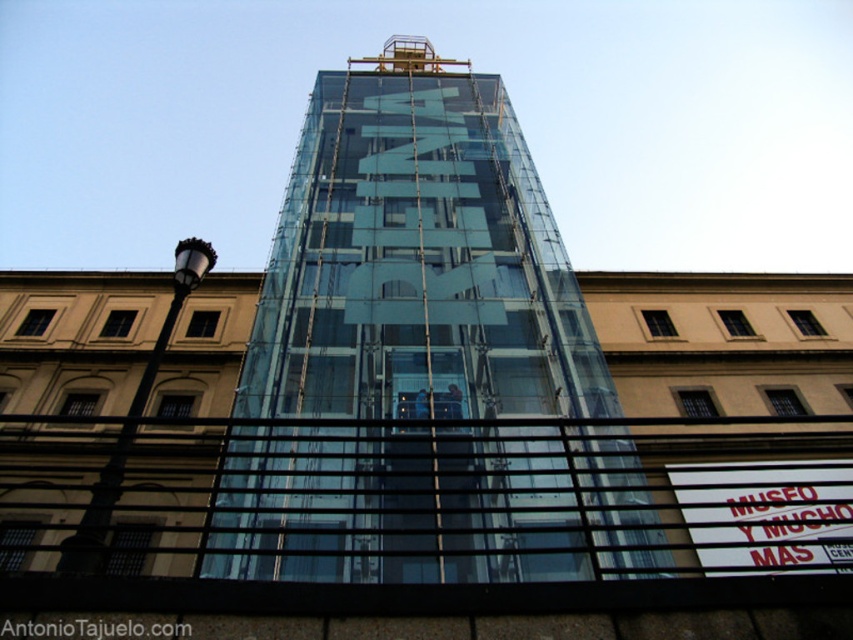
From the picture: Is transparent glass tower at center to the right of white plastic sign at lower right from the viewer's perspective?

Incorrect, transparent glass tower at center is not on the right side of white plastic sign at lower right.

Find the location of a particular element. transparent glass tower at center is located at coordinates (422, 356).

Find the location of a particular element. The width and height of the screenshot is (853, 640). transparent glass tower at center is located at coordinates (422, 356).